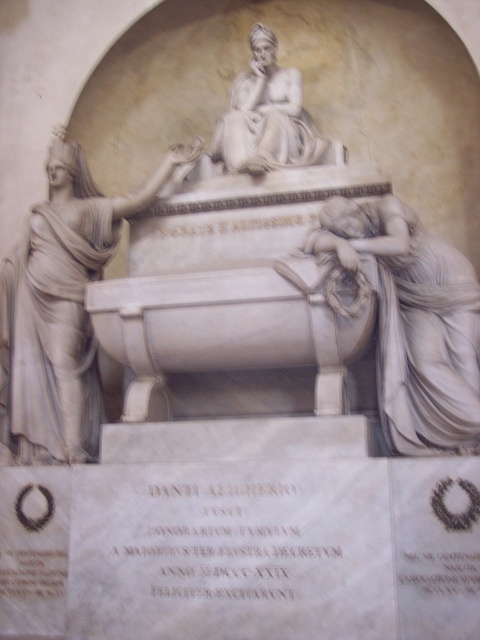
Question: Does white marble statue at left have a larger size compared to white marble statue at lower right?

Choices:
 (A) no
 (B) yes

Answer: (B)

Question: Is white marble sarcophagus at center wider than white marble statue at left?

Choices:
 (A) yes
 (B) no

Answer: (A)

Question: Among these objects, which one is nearest to the camera?

Choices:
 (A) white marble sarcophagus at center
 (B) white marble statue at left

Answer: (A)

Question: Which is farther from the white marble sarcophagus at center?

Choices:
 (A) white marble statue at lower right
 (B) white marble statue at left

Answer: (A)

Question: Which point is closer to the camera taking this photo?

Choices:
 (A) (418, 129)
 (B) (437, 440)
 (C) (167, 172)

Answer: (B)

Question: Is white marble statue at left wider than white marble statue at lower right?

Choices:
 (A) no
 (B) yes

Answer: (B)